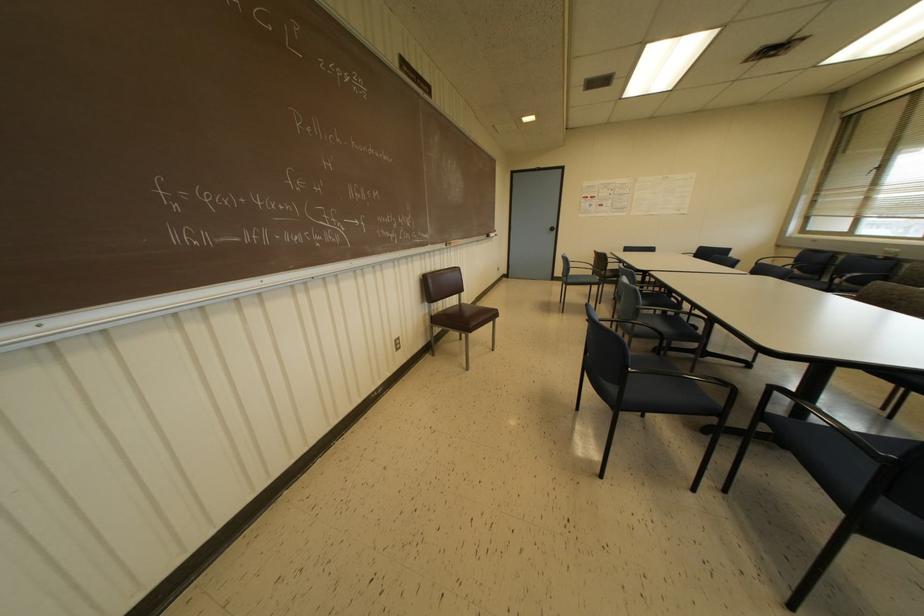
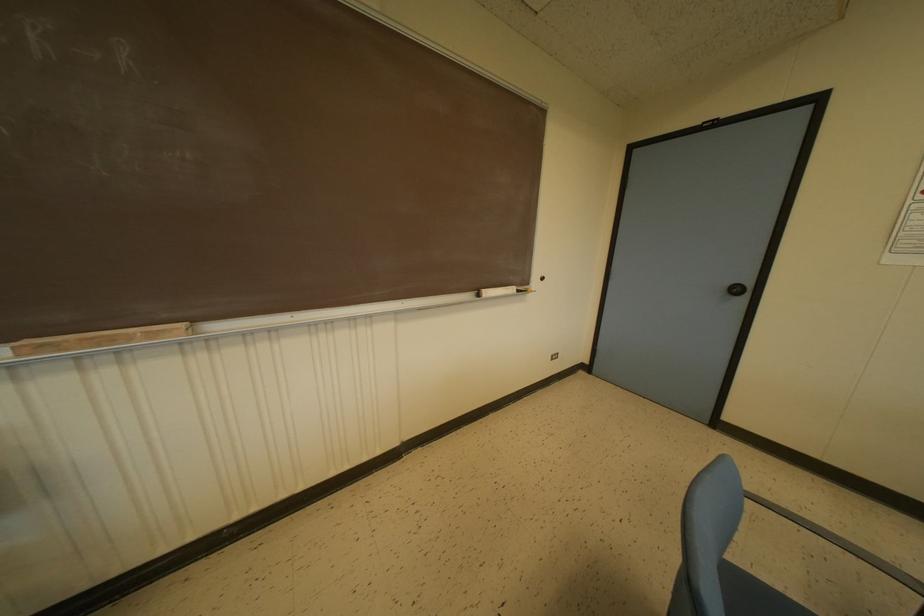
Locate, in the second image, the point that corresponds to (x=491, y=233) in the first image.

(487, 292)